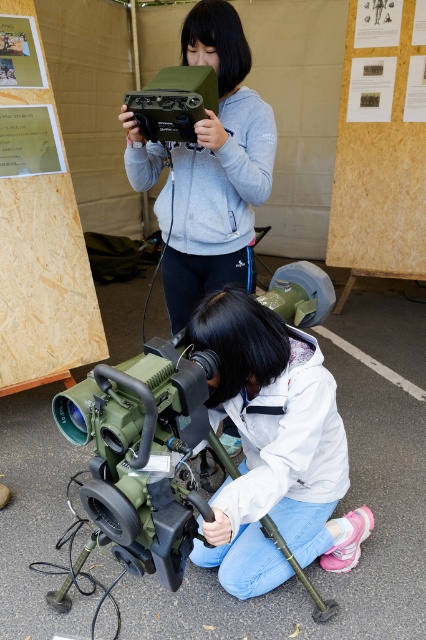
Which is above, wooden board at upper left or matte green plastic video camera at upper center?

matte green plastic video camera at upper center is higher up.

Does wooden board at upper left have a larger size compared to matte green plastic video camera at upper center?

Correct, wooden board at upper left is larger in size than matte green plastic video camera at upper center.

Does point (26, 252) lie behind point (173, 99)?

Yes, point (26, 252) is behind point (173, 99).

Find the location of `wooden board at upper left`. wooden board at upper left is located at coordinates (43, 282).

Does matte green device at upper center have a greater height compared to wooden board at upper left?

No.

Measure the distance between matte green device at upper center and camera.

matte green device at upper center and camera are 1.69 meters apart from each other.

Locate an element on the screen. The height and width of the screenshot is (640, 426). matte green device at upper center is located at coordinates (218, 168).

Is white matte jacket at lower center below matte green device at upper center?

Yes.

Does white matte jacket at lower center appear on the left side of matte green device at upper center?

In fact, white matte jacket at lower center is to the right of matte green device at upper center.

Who is more distant from viewer, (340,531) or (129,156)?

Point (129,156)

This screenshot has width=426, height=640. What are the coordinates of `white matte jacket at lower center` in the screenshot? It's located at (273, 448).